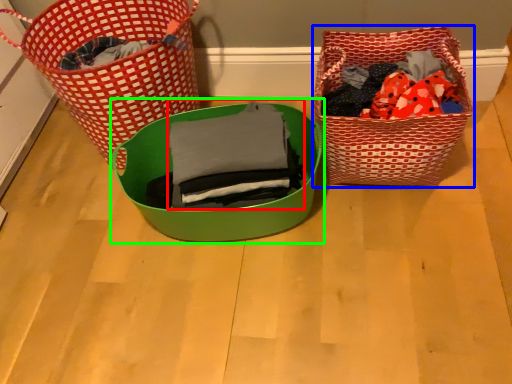
Question: Estimate the real-world distances between objects in this image. Which object is farther from clothing (highlighted by a red box), picnic basket (highlighted by a blue box) or gift basket (highlighted by a green box)?

Choices:
 (A) picnic basket
 (B) gift basket

Answer: (A)